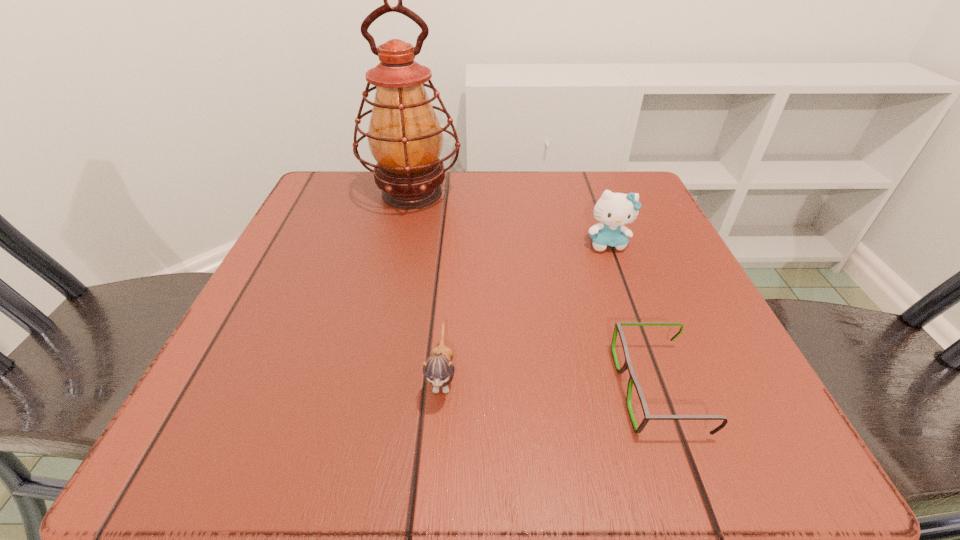
Where is `the tallest object`? This screenshot has height=540, width=960. the tallest object is located at coordinates (405, 138).

Identify the location of oil lamp. The width and height of the screenshot is (960, 540). (405, 138).

Find the location of a particular element. the third shortest object is located at coordinates (614, 210).

Find the location of a particular element. Image resolution: width=960 pixels, height=540 pixels. the farther kitten is located at coordinates (614, 210).

Image resolution: width=960 pixels, height=540 pixels. What are the coordinates of `the shorter kitten` in the screenshot? It's located at (438, 369).

At what (x,y) coordinates should I click in order to perform the action: click on the left kitten. Please return your answer as a coordinate pair (x, y). Looking at the image, I should click on (438, 369).

Where is `the shortest object`? the shortest object is located at coordinates (618, 329).

Identify the location of vacant space located 0.350m on the right of the farthest object. The image size is (960, 540). [x=621, y=194].

Where is `free space located 0.360m on the face of the second farthest object`? free space located 0.360m on the face of the second farthest object is located at coordinates 678,437.

The width and height of the screenshot is (960, 540). I want to click on vacant point located on the front-facing side of the nearer kitten, so click(436, 458).